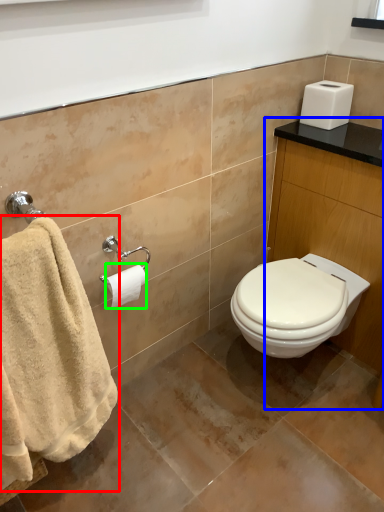
Question: Estimate the real-world distances between objects in this image. Which object is closer to towel (highlighted by a red box), vanity (highlighted by a blue box) or toilet paper (highlighted by a green box)?

Choices:
 (A) vanity
 (B) toilet paper

Answer: (B)